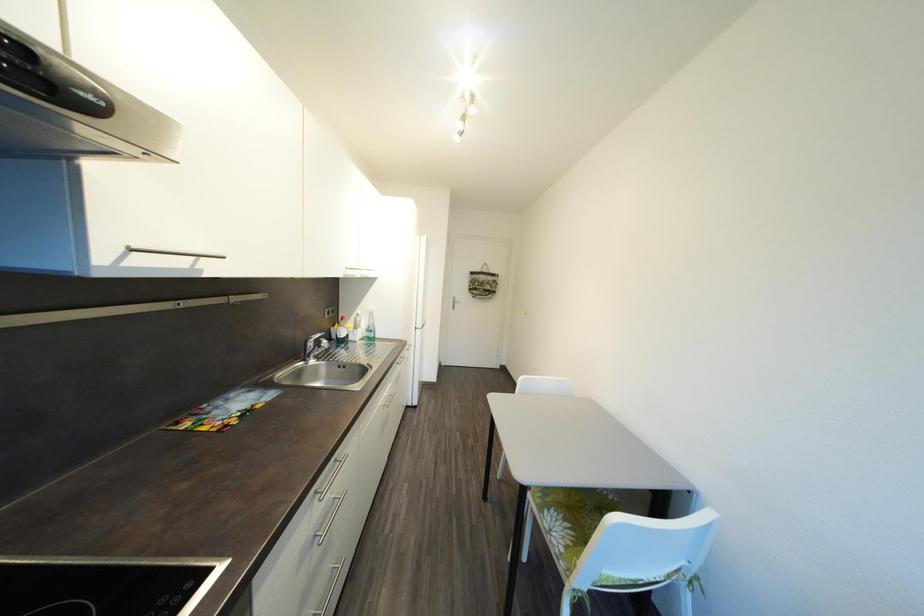
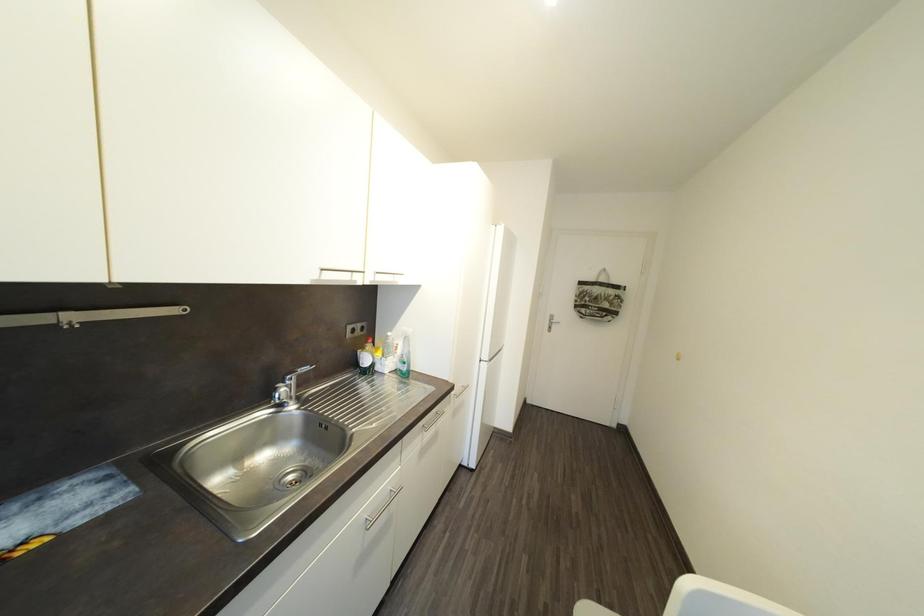
Question: The camera is either moving clockwise (left) or counter-clockwise (right) around the object. The first image is from the beginning of the video and the second image is from the end. Is the camera moving left or right when shooting the video?

Choices:
 (A) Left
 (B) Right

Answer: (B)